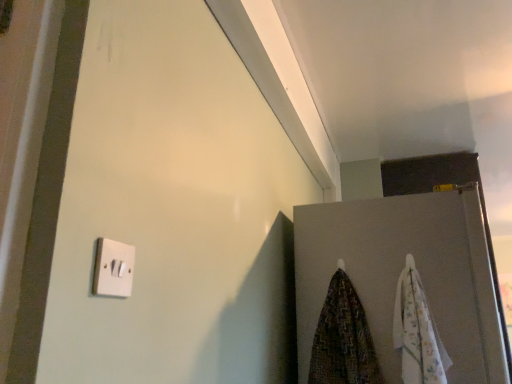
Question: From a real-world perspective, is white matte door at upper right above or below floral cotton beach towel at right, which appears as the second beach towel when viewed from the left?

Choices:
 (A) above
 (B) below

Answer: (A)

Question: Is white matte door at upper right bigger or smaller than floral cotton beach towel at right, which is the 1th beach towel from right to left?

Choices:
 (A) big
 (B) small

Answer: (A)

Question: Considering the real-world distances, which object is closest to the white plastic light switch at lower left?

Choices:
 (A) floral cotton beach towel at right, which appears as the second beach towel when viewed from the left
 (B) patterned fabric beach towel at lower right, the 1th beach towel in the left-to-right sequence
 (C) white matte door at upper right

Answer: (B)

Question: Which of these objects is positioned farthest from the white plastic light switch at lower left?

Choices:
 (A) white matte door at upper right
 (B) patterned fabric beach towel at lower right, the 1th beach towel in the left-to-right sequence
 (C) floral cotton beach towel at right, which appears as the second beach towel when viewed from the left

Answer: (A)